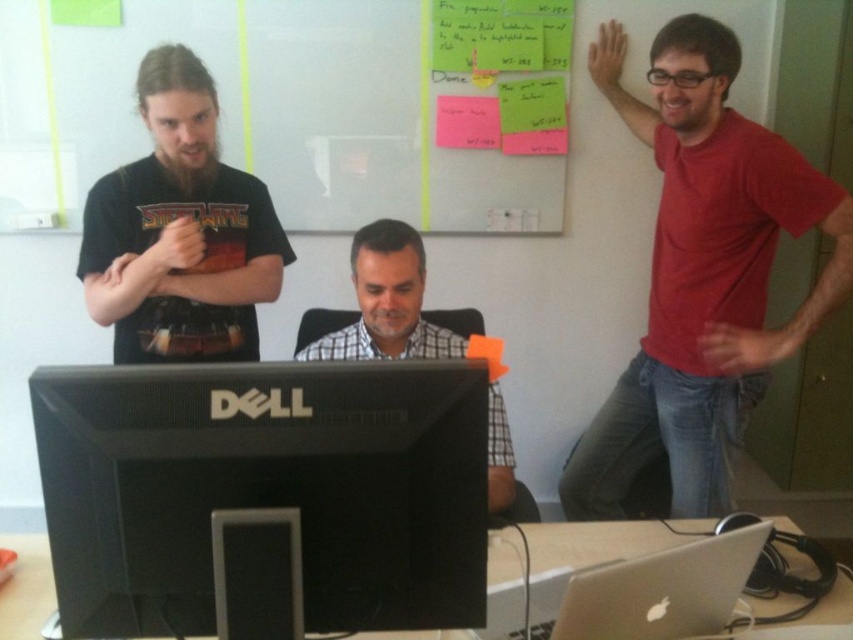
Which is more to the right, black matte t-shirt at left or white glossy table at lower center?

white glossy table at lower center

Locate an element on the screen. Image resolution: width=853 pixels, height=640 pixels. black matte t-shirt at left is located at coordinates (180, 230).

Image resolution: width=853 pixels, height=640 pixels. What do you see at coordinates (180, 230) in the screenshot? I see `black matte t-shirt at left` at bounding box center [180, 230].

Identify the location of black matte t-shirt at left. (180, 230).

Consider the image. Which is more to the right, red cotton t-shirt at right or silver metallic laptop at center?

Positioned to the right is red cotton t-shirt at right.

Does point (720, 113) come farther from viewer compared to point (733, 564)?

Yes, point (720, 113) is farther from viewer.

Where is `red cotton t-shirt at right`? red cotton t-shirt at right is located at coordinates (701, 273).

Is point (512, 561) positioned behind point (410, 301)?

No, (512, 561) is closer to viewer.

Between point (604, 552) and point (496, 470), which one is positioned behind?

Positioned behind is point (496, 470).

Locate an element on the screen. The image size is (853, 640). white glossy table at lower center is located at coordinates (595, 541).